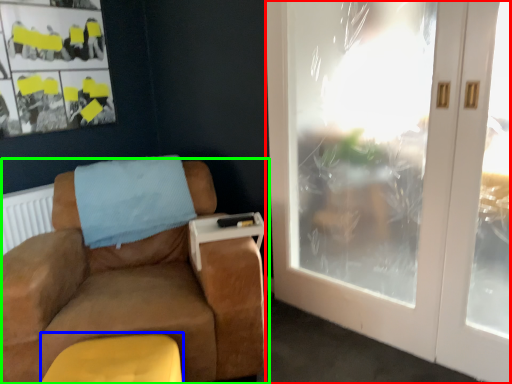
Question: Considering the real-world distances, which object is farthest from door (highlighted by a red box)? footrest (highlighted by a blue box) or chair (highlighted by a green box)?

Choices:
 (A) footrest
 (B) chair

Answer: (A)